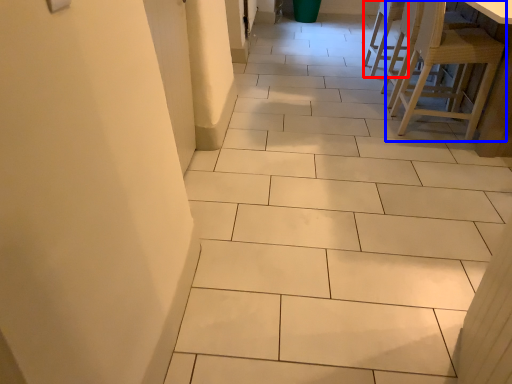
Question: Among these objects, which one is farthest to the camera, chair (highlighted by a red box) or chair (highlighted by a blue box)?

Choices:
 (A) chair
 (B) chair

Answer: (A)